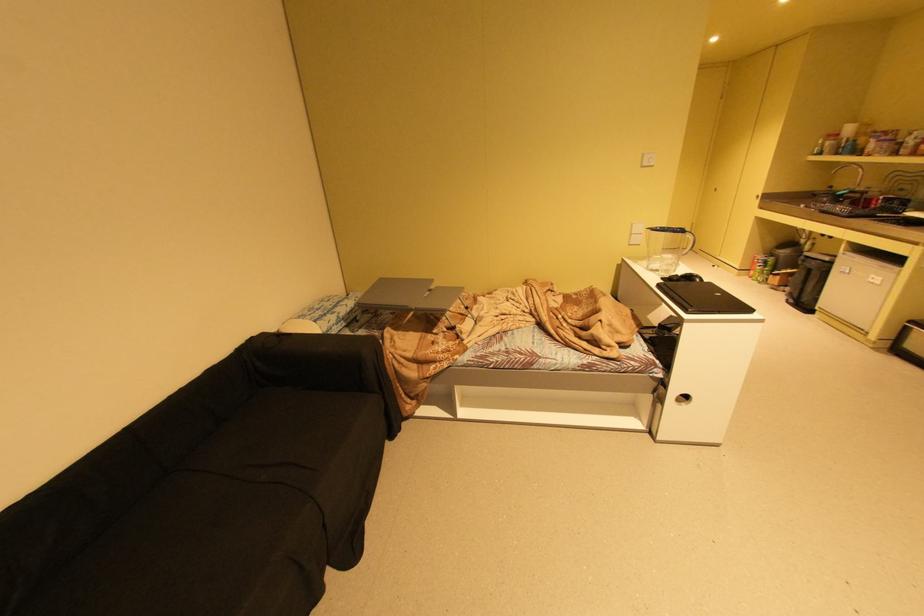
Find the location of a particular element. This screenshot has height=616, width=924. faucet handle is located at coordinates (852, 172).